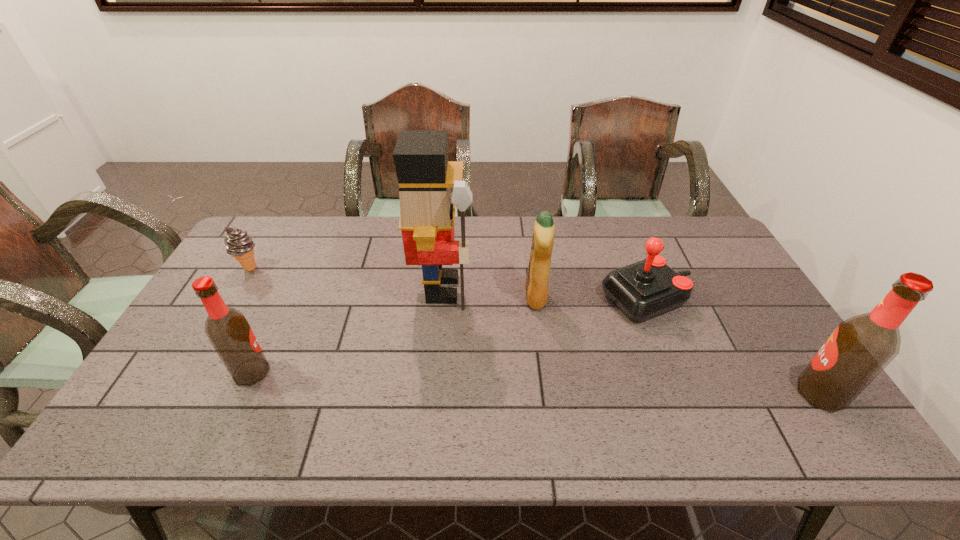
The width and height of the screenshot is (960, 540). I want to click on vacant area that satisfies the following two spatial constraints: 1. on the front side of the taller beer bottle; 2. on the right side of the icecream, so click(176, 394).

Find the location of a particular element. vacant space that satisfies the following two spatial constraints: 1. on the back side of the fifth tallest object; 2. in front of the nutcracker holding the staff is located at coordinates (643, 289).